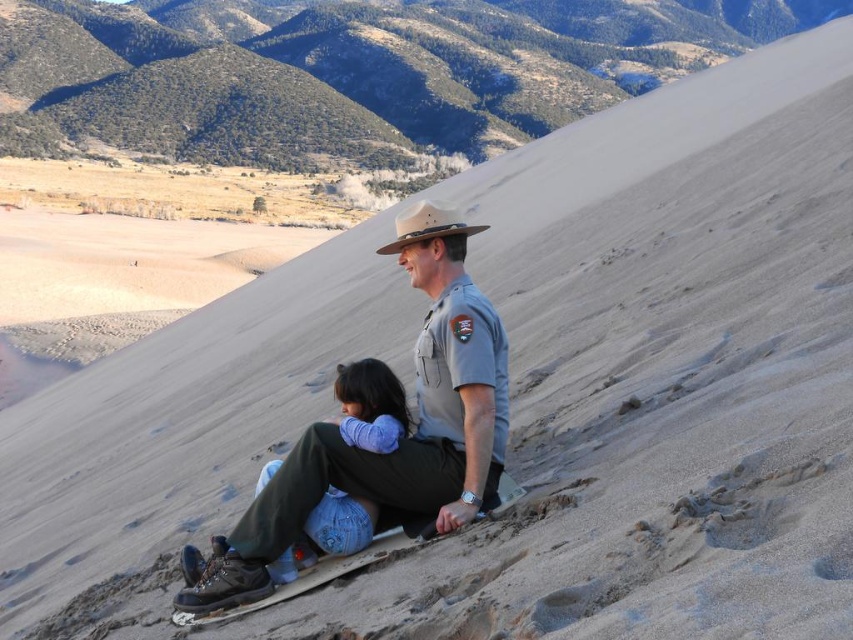
You are a photographer trying to capture the scene of two people on the sand dune. You want to ensure that both the denim pants at lower center and the light brown felt cowboy hat at center are clearly visible in the photo. Based on their heights, which object should you focus on first to ensure proper focus?

The denim pants at lower center has a lesser height compared to the light brown felt cowboy hat at center, so you should focus on the light brown felt cowboy hat at center first since it is taller and might require more precise focusing to capture details.

You are trying to decide whether to sit in front of the gray uniform at center or behind the light brown felt cowboy hat at center. Which position would allow you to have a better view of the surrounding desert landscape?

The light brown felt cowboy hat at center is behind the gray uniform at center, so sitting in front of the gray uniform at center would give you a better view of the surrounding desert landscape without obstruction from the hat.